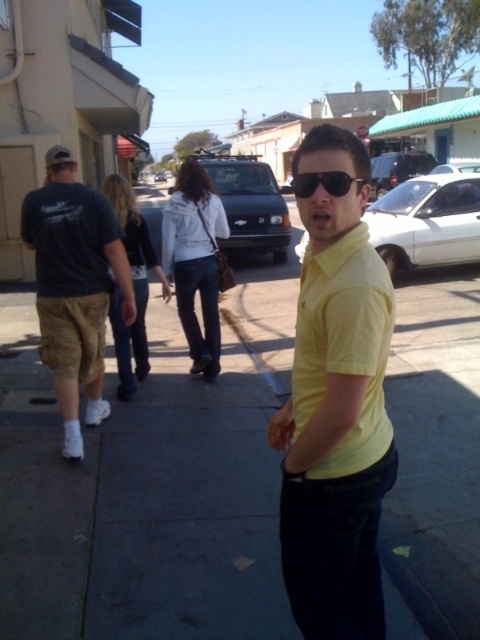
Question: Is yellow matte shirt at center in front of sunglasses at center?

Choices:
 (A) no
 (B) yes

Answer: (B)

Question: Is yellow matte shirt at center bigger than sunglasses at center?

Choices:
 (A) yes
 (B) no

Answer: (B)

Question: Which point is farther to the camera?

Choices:
 (A) sunglasses at center
 (B) yellow matte shirt at center
 (C) dark blue t-shirt at left
 (D) gray concrete sidewalk at center

Answer: (C)

Question: Considering the relative positions of gray concrete sidewalk at center and sunglasses at center in the image provided, where is gray concrete sidewalk at center located with respect to sunglasses at center?

Choices:
 (A) above
 (B) below

Answer: (B)

Question: Considering the real-world distances, which object is closest to the yellow matte shirt at center?

Choices:
 (A) gray concrete sidewalk at center
 (B) dark blue t-shirt at left
 (C) sunglasses at center

Answer: (C)

Question: Which is farther from the yellow matte shirt at center?

Choices:
 (A) sunglasses at center
 (B) gray concrete sidewalk at center
 (C) dark blue t-shirt at left

Answer: (C)